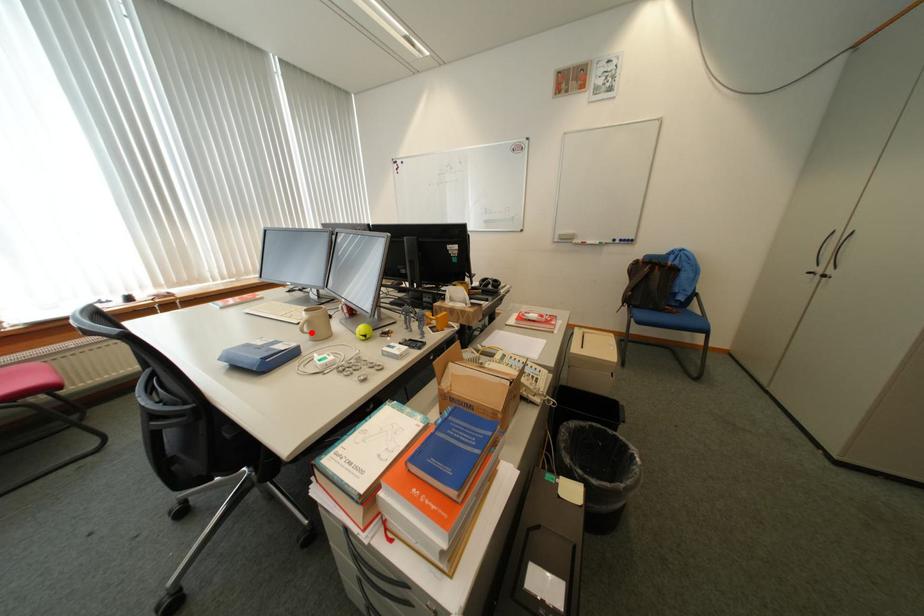
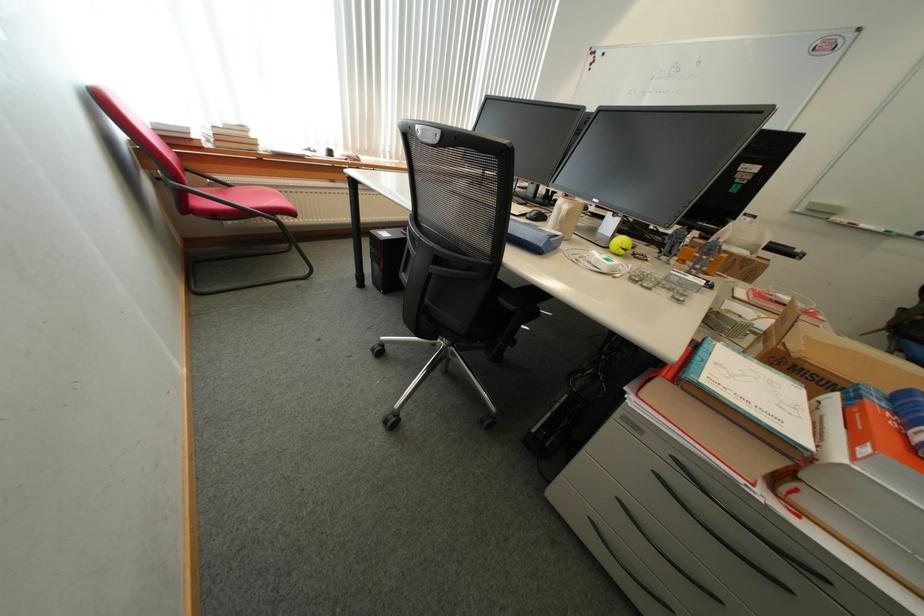
Find the pixel in the second image that matches the highlighted location in the first image.

(570, 223)